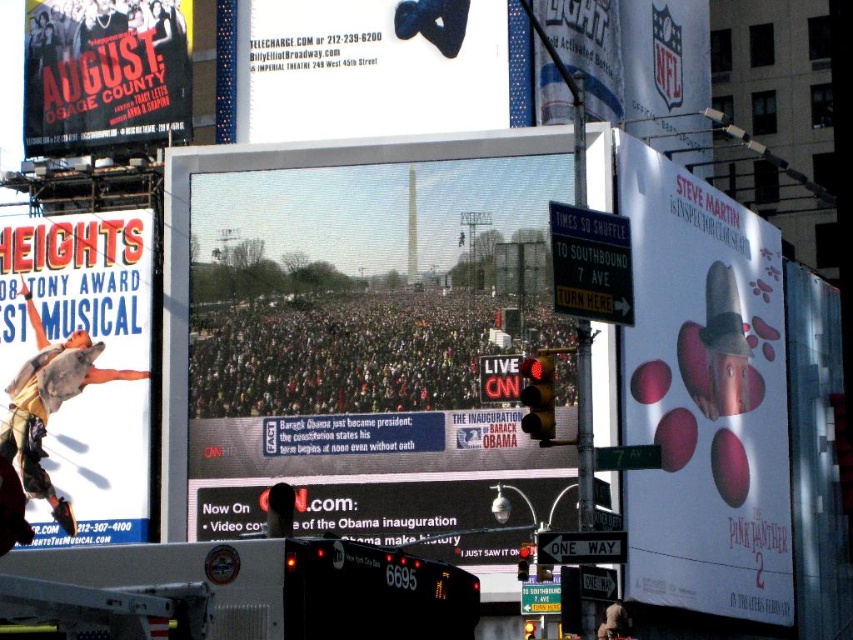
You are standing in front of the digital screen showing the crowd and want to take a photo. There are two points marked on the screen at coordinates point (650, 499) and point (730, 276). Which point will appear larger in your photo?

Point (650, 499) will appear larger in the photo because it is closer to the camera than point (730, 276).

You are a photographer trying to capture the entire scene of the matte digital display at center and the dark gray crowd at center in one shot. Based on their sizes, which object should you focus on first to ensure both are in frame?

The matte digital display at center is taller than the dark gray crowd at center, so you should focus on the matte digital display at center first to ensure both fit within the frame.